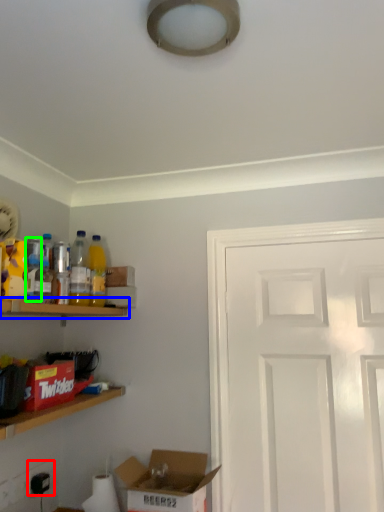
Question: Estimate the real-world distances between objects in this image. Which object is farther from electric outlet (highlighted by a red box), shelf (highlighted by a blue box) or bottle (highlighted by a green box)?

Choices:
 (A) shelf
 (B) bottle

Answer: (B)